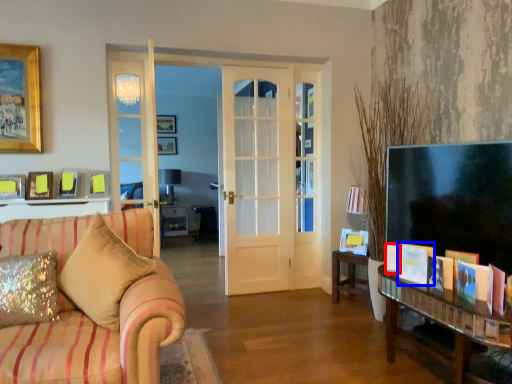
Question: Which object is further to the camera taking this photo, book (highlighted by a red box) or book (highlighted by a blue box)?

Choices:
 (A) book
 (B) book

Answer: (A)